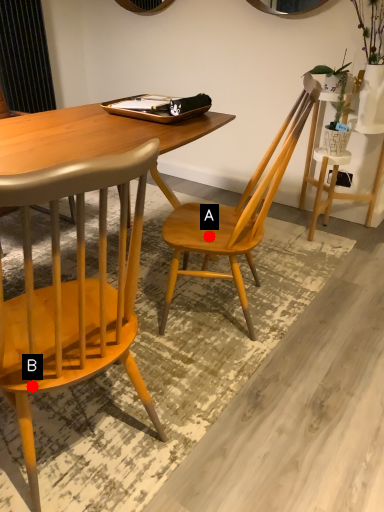
Question: Two points are circled on the image, labeled by A and B beside each circle. Which point is farther to the camera?

Choices:
 (A) A is further
 (B) B is further

Answer: (A)